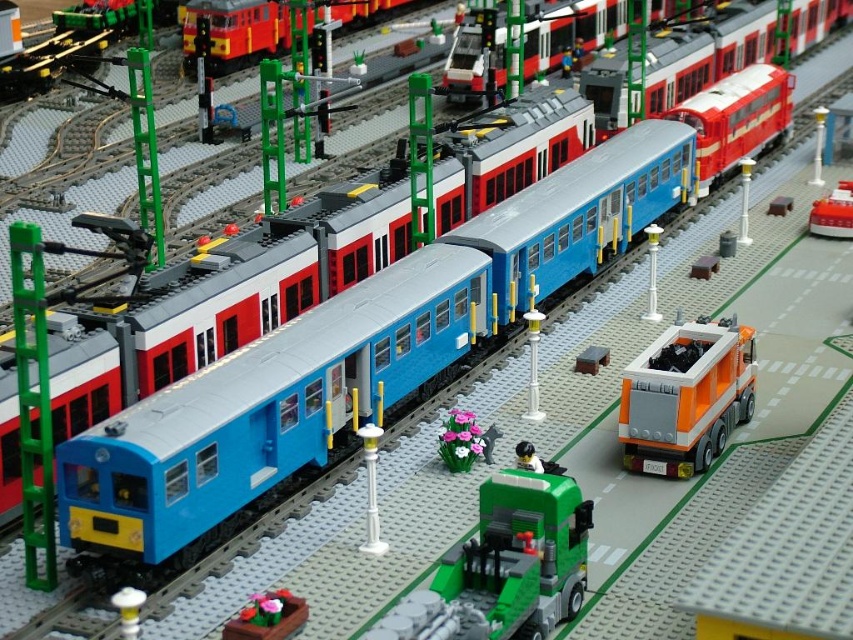
You are standing at the Lego train station platform. You see a point marked at coordinates (235, 33). What object is located at that point?

The point at coordinates (235, 33) marks the brick red train at upper center.

You are a Lego designer trying to place a smooth pink flower pot at lower center on the roof of the brick red train at upper center. Will the flower pot fit on the roof based on their sizes?

The brick red train at upper center is taller than the smooth pink flower pot at lower center. Since the train is taller, the flower pot might fit on the roof, but the exact dimensions are not provided. However, since the train is taller, there is a possibility the flower pot can be placed there.

What are the coordinates of the smooth pink flower pot at lower center?

The smooth pink flower pot at lower center is located at coordinates point (268,616).